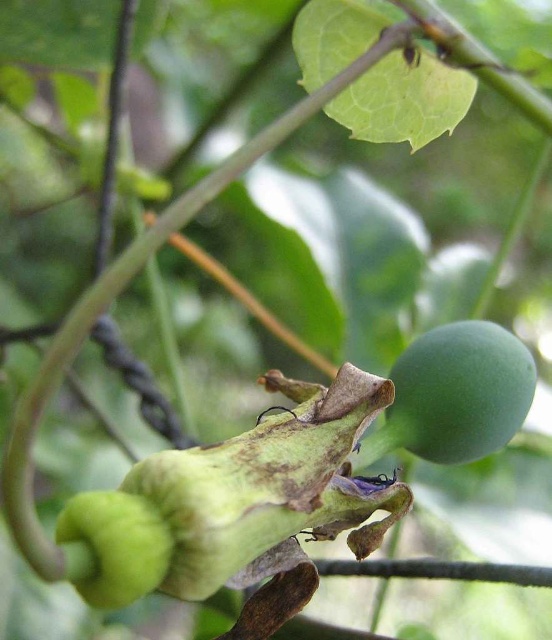
Who is more forward, (402,429) or (103,515)?

Point (103,515) is more forward.

Which is more to the left, green matte fruit at upper right or green matte fruit at lower left?

From the viewer's perspective, green matte fruit at lower left appears more on the left side.

What do you see at coordinates (460, 392) in the screenshot? I see `green matte fruit at upper right` at bounding box center [460, 392].

Locate an element on the screen. green matte fruit at upper right is located at coordinates (460, 392).